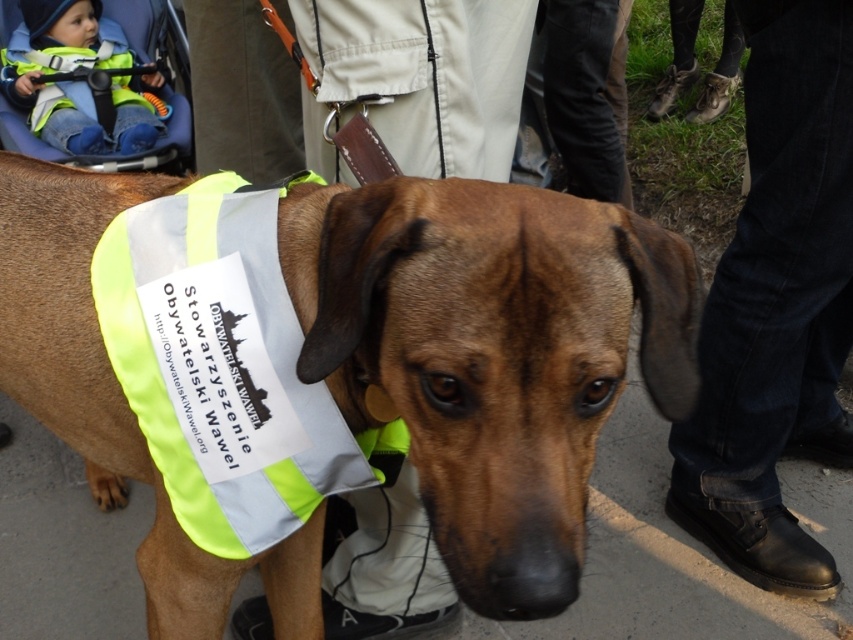
Is neon yellow vest at center smaller than jeans at lower right?

No.

Does point (312, 205) come farther from viewer compared to point (805, 374)?

That is False.

Which is behind, point (355, 426) or point (799, 209)?

The point (799, 209) is more distant.

Image resolution: width=853 pixels, height=640 pixels. Identify the location of neon yellow vest at center. (334, 365).

Between jeans at lower right and neon yellow fabric safety vest at center, which one has less height?

With less height is neon yellow fabric safety vest at center.

Is point (724, 529) in front of point (387, 438)?

No, it is behind (387, 438).

The image size is (853, 640). I want to click on jeans at lower right, so click(x=776, y=307).

Where is `jeans at lower right`? The image size is (853, 640). jeans at lower right is located at coordinates (776, 307).

Can you confirm if neon yellow vest at center is positioned below matte green vest at upper left?

Correct, neon yellow vest at center is located below matte green vest at upper left.

Consider the image. Is neon yellow vest at center shorter than matte green vest at upper left?

No, neon yellow vest at center is not shorter than matte green vest at upper left.

Measure the distance between neon yellow vest at center and camera.

neon yellow vest at center and camera are 31.90 inches apart.

At what (x,y) coordinates should I click in order to perform the action: click on neon yellow vest at center. Please return your answer as a coordinate pair (x, y). Looking at the image, I should click on (334, 365).